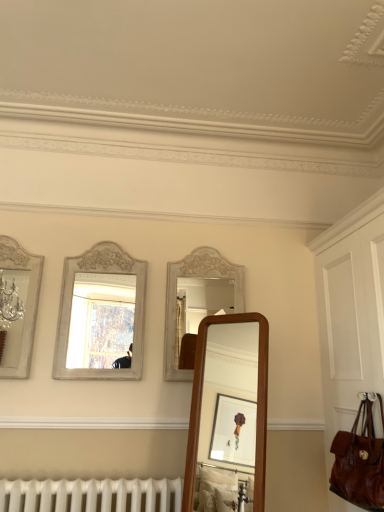
Question: From the image's perspective, is brown leather bag at right on silver metallic mirror at left, arranged as the 1th mirror when viewed from the left?

Choices:
 (A) no
 (B) yes

Answer: (A)

Question: From the image's perspective, is brown leather bag at right located beneath silver metallic mirror at left, placed as the 2th mirror when sorted from right to left?

Choices:
 (A) yes
 (B) no

Answer: (A)

Question: Does brown leather bag at right have a greater height compared to silver metallic mirror at left, placed as the 2th mirror when sorted from right to left?

Choices:
 (A) no
 (B) yes

Answer: (B)

Question: Is brown leather bag at right positioned in front of silver metallic mirror at left, placed as the 2th mirror when sorted from right to left?

Choices:
 (A) no
 (B) yes

Answer: (B)

Question: Considering the relative sizes of brown leather bag at right and silver metallic mirror at left, arranged as the 1th mirror when viewed from the left, in the image provided, is brown leather bag at right shorter than silver metallic mirror at left, arranged as the 1th mirror when viewed from the left,?

Choices:
 (A) yes
 (B) no

Answer: (B)

Question: Could silver metallic mirror at left, arranged as the 1th mirror when viewed from the left, be considered to be inside brown leather bag at right?

Choices:
 (A) no
 (B) yes

Answer: (A)

Question: From a real-world perspective, is silver metallic mirror at left, arranged as the 1th mirror when viewed from the left, physically below white painted wood mirror at center, the 2th mirror viewed from the left?

Choices:
 (A) yes
 (B) no

Answer: (B)

Question: Does silver metallic mirror at left, placed as the 2th mirror when sorted from right to left, have a larger size compared to white painted wood mirror at center, the 2th mirror viewed from the left?

Choices:
 (A) no
 (B) yes

Answer: (A)

Question: Are silver metallic mirror at left, arranged as the 1th mirror when viewed from the left, and white painted wood mirror at center, the 2th mirror viewed from the left, beside each other?

Choices:
 (A) no
 (B) yes

Answer: (A)

Question: Is silver metallic mirror at left, placed as the 2th mirror when sorted from right to left, behind white painted wood mirror at center, marked as the first mirror in a right-to-left arrangement?

Choices:
 (A) no
 (B) yes

Answer: (A)

Question: Is silver metallic mirror at left, placed as the 2th mirror when sorted from right to left, shorter than white painted wood mirror at center, marked as the first mirror in a right-to-left arrangement?

Choices:
 (A) no
 (B) yes

Answer: (B)

Question: Is silver metallic mirror at left, placed as the 2th mirror when sorted from right to left, completely or partially outside of white painted wood mirror at center, the 2th mirror viewed from the left?

Choices:
 (A) no
 (B) yes

Answer: (B)

Question: Can you confirm if silver metallic mirror at left, arranged as the 1th mirror when viewed from the left, is smaller than brown leather handbag at lower right?

Choices:
 (A) no
 (B) yes

Answer: (B)